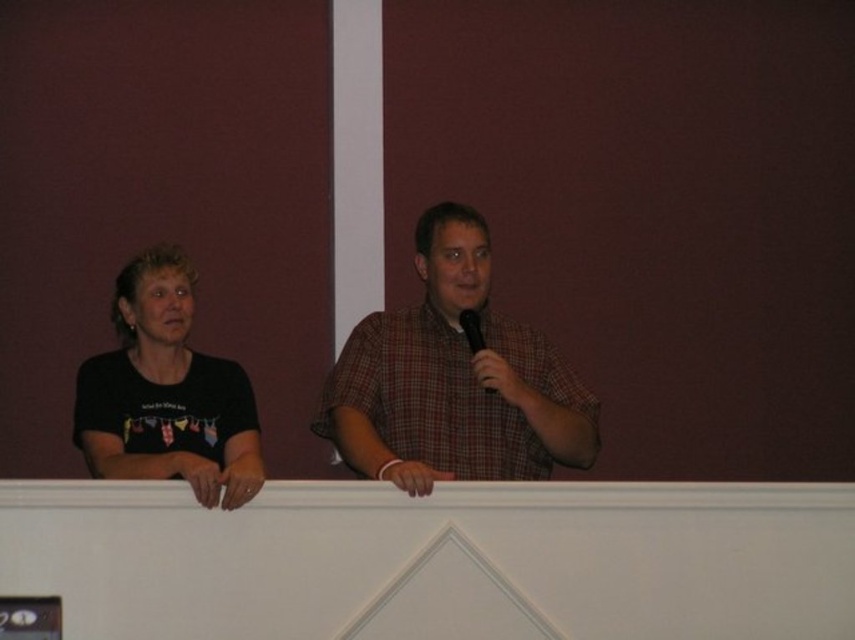
Question: Does plaid shirt at center have a greater width compared to black t-shirt at left?

Choices:
 (A) no
 (B) yes

Answer: (B)

Question: Is black t-shirt at left wider than black plastic microphone at center?

Choices:
 (A) no
 (B) yes

Answer: (B)

Question: Which object is farther from the camera taking this photo?

Choices:
 (A) black t-shirt at left
 (B) black plastic microphone at center
 (C) plaid shirt at center

Answer: (B)

Question: Among these points, which one is farthest from the camera?

Choices:
 (A) (178, 388)
 (B) (476, 342)

Answer: (A)

Question: Which of the following is the closest to the observer?

Choices:
 (A) black t-shirt at left
 (B) black plastic microphone at center

Answer: (A)

Question: Is plaid shirt at center bigger than black t-shirt at left?

Choices:
 (A) no
 (B) yes

Answer: (B)